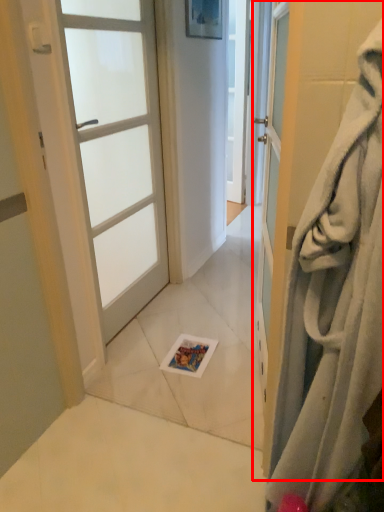
Question: From the image's perspective, what is the correct spatial relationship of door (annotated by the red box) in relation to door?

Choices:
 (A) above
 (B) below

Answer: (B)